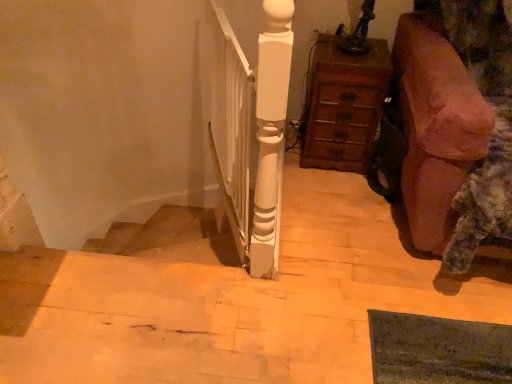
Question: From a real-world perspective, is wooden chest of drawers at right over brown fabric couch at right?

Choices:
 (A) no
 (B) yes

Answer: (A)

Question: From the image's perspective, would you say wooden chest of drawers at right is positioned over brown fabric couch at right?

Choices:
 (A) yes
 (B) no

Answer: (A)

Question: Does wooden chest of drawers at right have a lesser width compared to brown fabric couch at right?

Choices:
 (A) yes
 (B) no

Answer: (A)

Question: Is wooden chest of drawers at right not inside brown fabric couch at right?

Choices:
 (A) no
 (B) yes

Answer: (B)

Question: From the image's perspective, is wooden chest of drawers at right under brown fabric couch at right?

Choices:
 (A) no
 (B) yes

Answer: (A)

Question: In the image, is white glossy wooden post at center on the left side or the right side of brown fabric couch at right?

Choices:
 (A) right
 (B) left

Answer: (B)

Question: Is white glossy wooden post at center taller or shorter than brown fabric couch at right?

Choices:
 (A) short
 (B) tall

Answer: (A)

Question: In the image, is white glossy wooden post at center positioned in front of or behind brown fabric couch at right?

Choices:
 (A) behind
 (B) front

Answer: (A)

Question: From a real-world perspective, is white glossy wooden post at center physically located above or below brown fabric couch at right?

Choices:
 (A) above
 (B) below

Answer: (B)

Question: From a real-world perspective, is wooden chest of drawers at right positioned above or below brown fabric couch at right?

Choices:
 (A) below
 (B) above

Answer: (A)

Question: Based on their positions, is wooden chest of drawers at right located to the left or right of brown fabric couch at right?

Choices:
 (A) right
 (B) left

Answer: (B)

Question: Considering the positions of point [308, 104] and point [401, 120], is point [308, 104] closer or farther from the camera than point [401, 120]?

Choices:
 (A) farther
 (B) closer

Answer: (A)

Question: Is wooden chest of drawers at right taller or shorter than brown fabric couch at right?

Choices:
 (A) tall
 (B) short

Answer: (B)

Question: Would you say brown fabric couch at right is to the left or to the right of white glossy wooden post at center in the picture?

Choices:
 (A) right
 (B) left

Answer: (A)

Question: Relative to white glossy wooden post at center, is brown fabric couch at right in front or behind?

Choices:
 (A) front
 (B) behind

Answer: (A)